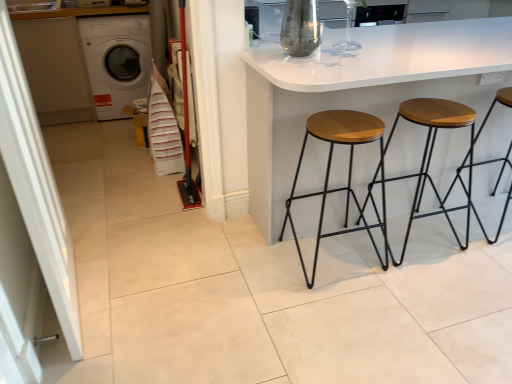
Locate an element on the screen. vacant space in front of woodenmaterial/texturestool at center, the 1th stool from the left is located at coordinates (349, 311).